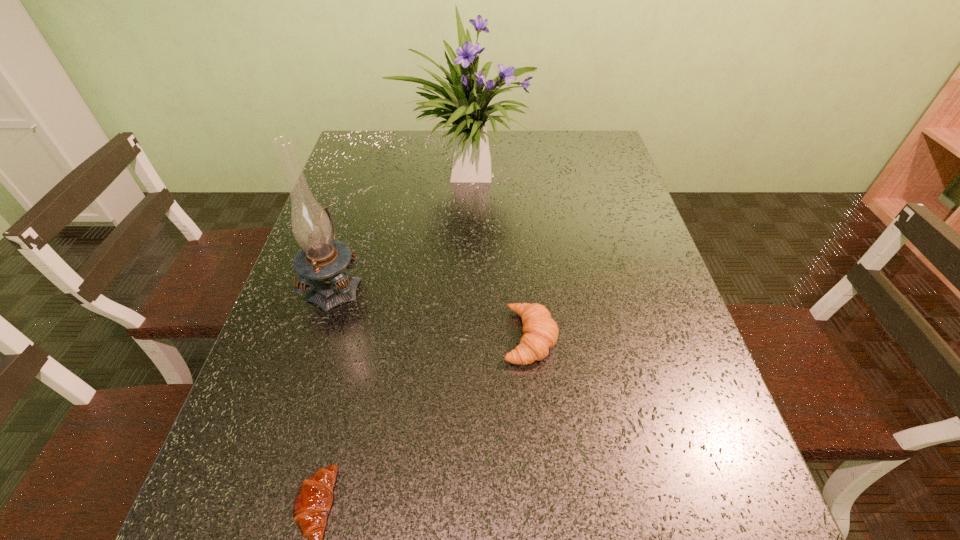
Identify the location of vacant space that satisfies the following two spatial constraints: 1. on the front side of the third tallest object; 2. on the right side of the farthest object. This screenshot has width=960, height=540. (460, 338).

In order to click on free space that satisfies the following two spatial constraints: 1. on the front side of the third tallest object; 2. on the left side of the farthest object in this screenshot , I will do `click(460, 338)`.